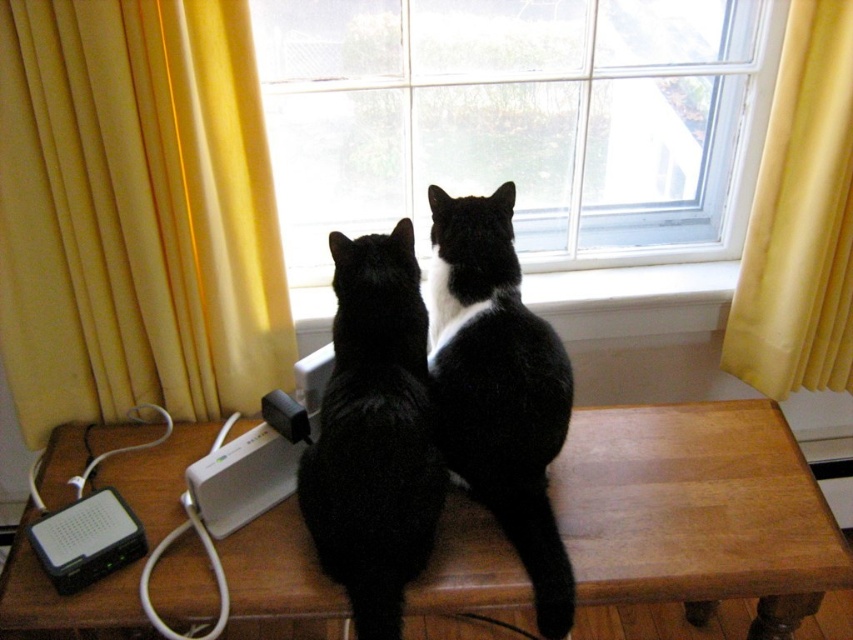
Measure the distance between black matte fur cat at center and white smooth window sill at center.

A distance of 21.44 inches exists between black matte fur cat at center and white smooth window sill at center.

Image resolution: width=853 pixels, height=640 pixels. What do you see at coordinates (374, 435) in the screenshot? I see `black matte fur cat at center` at bounding box center [374, 435].

Locate an element on the screen. black matte fur cat at center is located at coordinates pyautogui.click(x=374, y=435).

Is point (805, 314) positioned behind point (556, 275)?

No, it is in front of (556, 275).

Is yellow fabric curtain at right in front of white smooth window sill at center?

Yes, yellow fabric curtain at right is closer to the viewer.

Is point (755, 276) less distant than point (567, 291)?

That is True.

Find the location of `yellow fabric curtain at right`. yellow fabric curtain at right is located at coordinates (799, 220).

Can you confirm if transparent glass window at center is shorter than yellow fabric curtain at left?

Correct, transparent glass window at center is not as tall as yellow fabric curtain at left.

Which is above, transparent glass window at center or yellow fabric curtain at left?

transparent glass window at center is above.

Find the location of a particular element. transparent glass window at center is located at coordinates (520, 120).